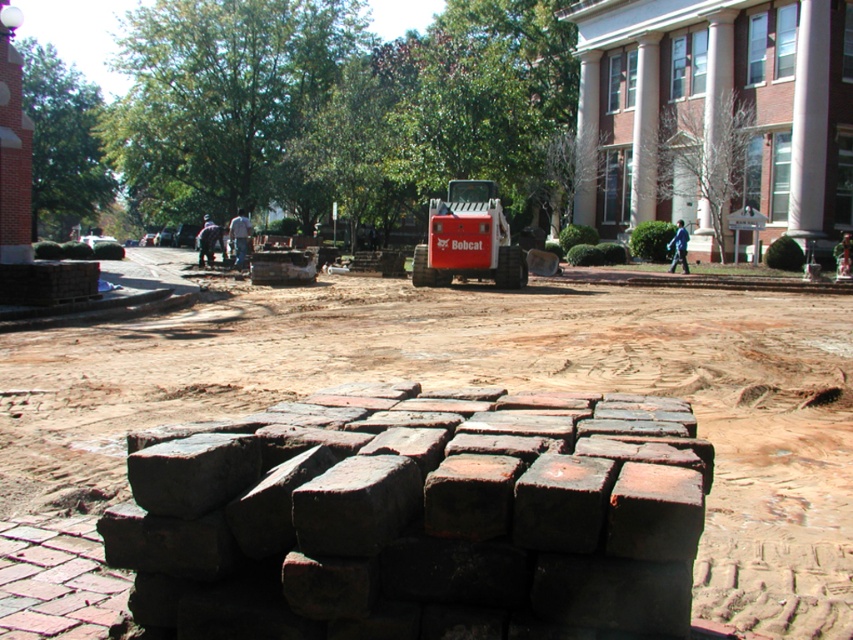
Question: Is brown dirt field at center further to the viewer compared to red rubber bobcat at center?

Choices:
 (A) yes
 (B) no

Answer: (B)

Question: Does brown dirt field at center come in front of dark red brick at center?

Choices:
 (A) yes
 (B) no

Answer: (B)

Question: Which point appears closest to the camera in this image?

Choices:
 (A) (474, 275)
 (B) (757, 336)

Answer: (B)

Question: Which of these objects is positioned farthest from the brown dirt field at center?

Choices:
 (A) dark red brick at center
 (B) red rubber bobcat at center

Answer: (B)

Question: Does brown dirt field at center have a larger size compared to red rubber bobcat at center?

Choices:
 (A) no
 (B) yes

Answer: (B)

Question: Which point appears closest to the camera in this image?

Choices:
 (A) coord(653,564)
 (B) coord(610,330)
 (C) coord(502,273)

Answer: (A)